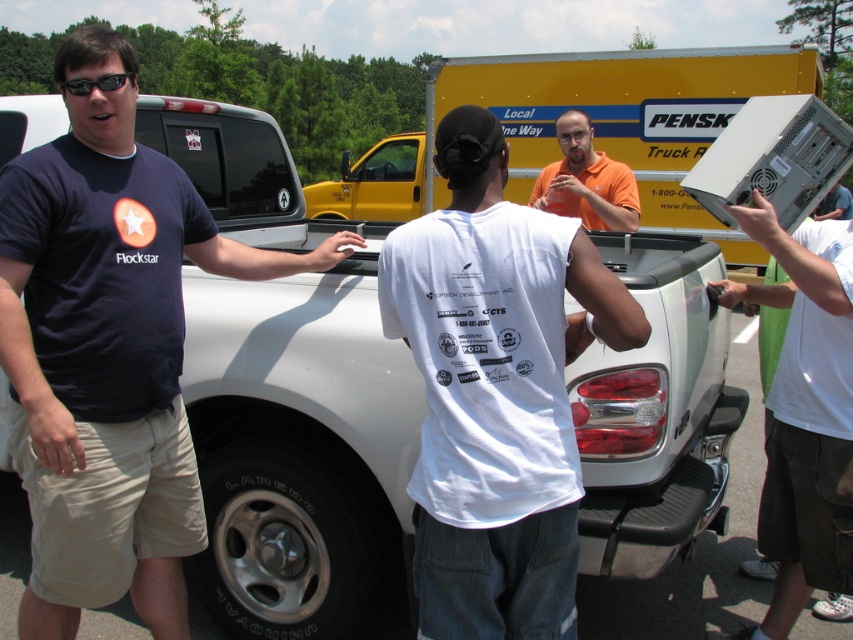
You are trying to determine if an object is large enough to block the view of another object in the scene. Which object, the orange matte shirt at center or the black plastic sunglasses at upper left, is wider and thus more likely to obstruct the view?

The orange matte shirt at center is wider than the black plastic sunglasses at upper left, so it is more likely to obstruct the view.

You are a photographer taking a picture of the orange matte shirt at center and the black plastic sunglasses at upper left. Which object will appear larger in the photo?

The orange matte shirt at center will appear larger in the photo because it has a greater height compared to the black plastic sunglasses at upper left.